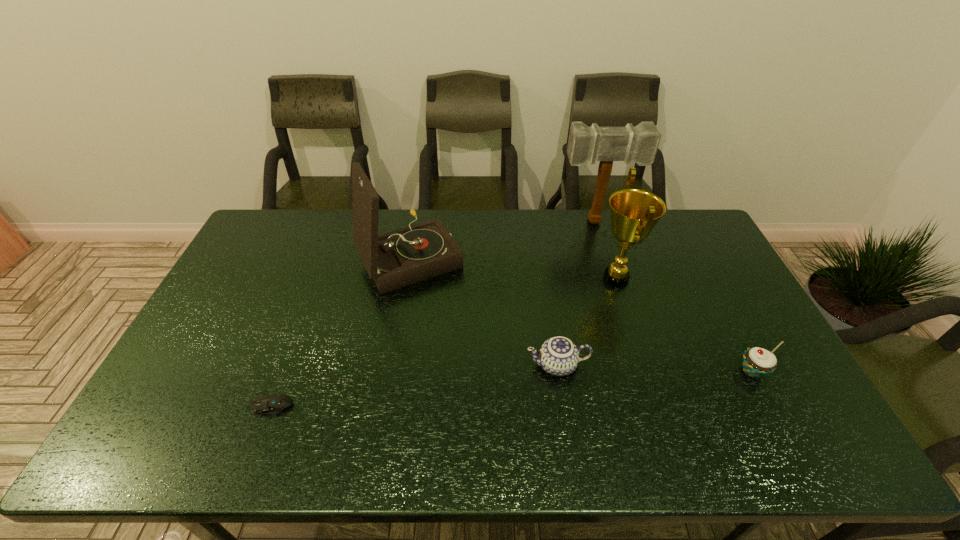
Identify the location of free region located on the front view with handles of the award. The height and width of the screenshot is (540, 960). (543, 279).

I want to click on vacant space located on the front view with handles of the award, so click(x=562, y=279).

Image resolution: width=960 pixels, height=540 pixels. Identify the location of free space located on the back of the cupcake. (728, 325).

This screenshot has width=960, height=540. Find the location of `vacant area located 0.240m from the spout of the chinaware`. vacant area located 0.240m from the spout of the chinaware is located at coordinates (438, 365).

I want to click on free space located from the spout of the chinaware, so click(463, 365).

At what (x,y) coordinates should I click in order to perform the action: click on free point located from the spout of the chinaware. Please return your answer as a coordinate pair (x, y). Looking at the image, I should click on (426, 365).

At what (x,y) coordinates should I click in order to perform the action: click on vacant area situated 0.050m on the right of the leftmost object. Please return your answer as a coordinate pair (x, y). Looking at the image, I should click on point(312,406).

In order to click on mallet located at the far edge in this screenshot , I will do `click(639, 144)`.

The width and height of the screenshot is (960, 540). Find the location of `phonograph record at the far edge`. phonograph record at the far edge is located at coordinates (396, 259).

Where is `object that is at the right edge`? This screenshot has width=960, height=540. object that is at the right edge is located at coordinates (757, 362).